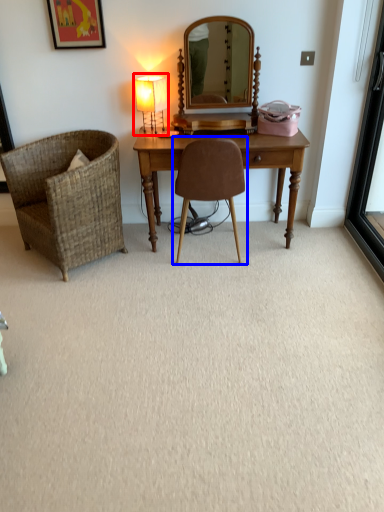
Question: Among these objects, which one is farthest to the camera, table lamp (highlighted by a red box) or chair (highlighted by a blue box)?

Choices:
 (A) table lamp
 (B) chair

Answer: (A)